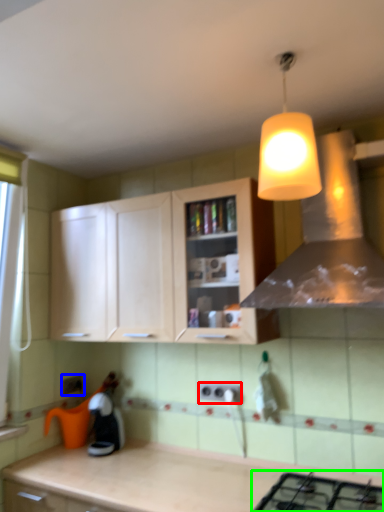
Question: Which object is the farthest from electric outlet (highlighted by a red box)? Choose among these: electric outlet (highlighted by a blue box) or gas stove (highlighted by a green box).

Choices:
 (A) electric outlet
 (B) gas stove

Answer: (A)